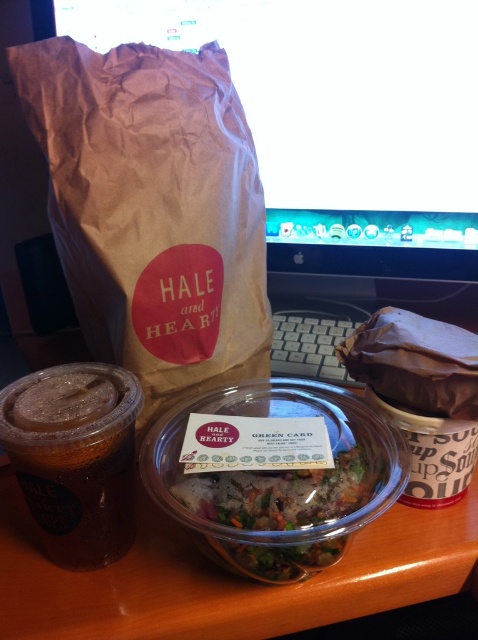
You are a customer at Hale and Hearty and you want to place your items on the desk so that the taller item is on the right side. Currently, the brown paper bag at upper left and the translucent plastic cup at left are positioned on the left side of the desk. Which item should you move to the right to fulfill this requirement?

The brown paper bag at upper left is taller than the translucent plastic cup at left. To place the taller item on the right side, you should move the brown paper bag at upper left to the right side of the desk.